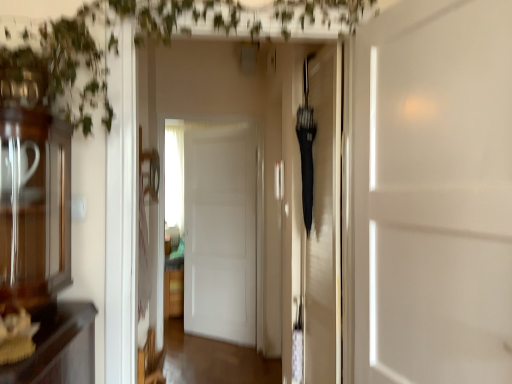
Question: Does black matte umbrella at center, which is the second door in front-to-back order, have a lesser height compared to white matte door at center, the 3th door from the front?

Choices:
 (A) yes
 (B) no

Answer: (A)

Question: Is black matte umbrella at center, which is the second door in front-to-back order, positioned in front of white matte door at center, which is the first door from back to front?

Choices:
 (A) yes
 (B) no

Answer: (A)

Question: Can you confirm if black matte umbrella at center, which is the second door in front-to-back order, is thinner than white matte door at center, which is the first door from back to front?

Choices:
 (A) yes
 (B) no

Answer: (B)

Question: Can you confirm if black matte umbrella at center, marked as the second door in a right-to-left arrangement, is positioned to the right of white matte door at center, which ranks as the 1th door in left-to-right order?

Choices:
 (A) yes
 (B) no

Answer: (A)

Question: Is white matte door at center, which ranks as the 1th door in left-to-right order, completely or partially inside black matte umbrella at center, the 2th door positioned from the left?

Choices:
 (A) yes
 (B) no

Answer: (B)

Question: From a real-world perspective, is black matte umbrella at center, the 2th door positioned from the left, beneath white matte door at center, which ranks as the 1th door in left-to-right order?

Choices:
 (A) yes
 (B) no

Answer: (B)

Question: Could you tell me if green leafy plant at upper left is facing white matte door at center, placed as the 3th door when sorted from back to front?

Choices:
 (A) no
 (B) yes

Answer: (A)

Question: Is the position of green leafy plant at upper left less distant than that of white matte door at center, placed as the 3th door when sorted from back to front?

Choices:
 (A) yes
 (B) no

Answer: (B)

Question: Is green leafy plant at upper left to the right of white matte door at center, arranged as the first door when viewed from the front, from the viewer's perspective?

Choices:
 (A) no
 (B) yes

Answer: (A)

Question: Does green leafy plant at upper left have a larger size compared to white matte door at center, which appears as the third door when viewed from the left?

Choices:
 (A) no
 (B) yes

Answer: (B)

Question: From the image's perspective, does green leafy plant at upper left appear higher than white matte door at center, arranged as the first door when viewed from the front?

Choices:
 (A) yes
 (B) no

Answer: (A)

Question: From a real-world perspective, is green leafy plant at upper left positioned under white matte door at center, which appears as the third door when viewed from the left, based on gravity?

Choices:
 (A) no
 (B) yes

Answer: (A)

Question: Is green leafy plant at upper left smaller than white matte door at center, marked as the 3th door in a right-to-left arrangement?

Choices:
 (A) yes
 (B) no

Answer: (B)